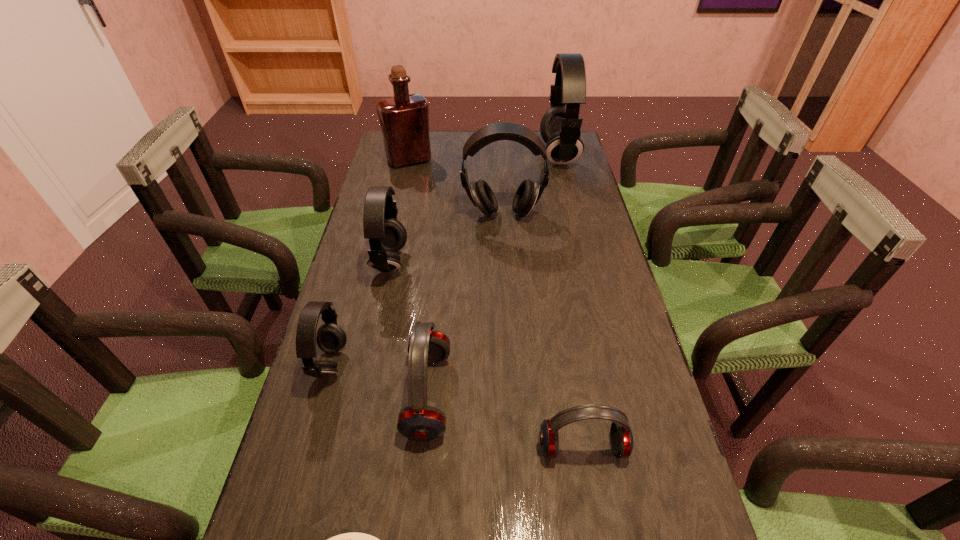
Image resolution: width=960 pixels, height=540 pixels. What are the coordinates of `vacant space that is in between the third farthest black earphone and the smallest black earphone` in the screenshot? It's located at (360, 314).

Find the location of `vacant region between the seventh tallest object and the sixth nearest object`. vacant region between the seventh tallest object and the sixth nearest object is located at coordinates (542, 330).

Image resolution: width=960 pixels, height=540 pixels. In order to click on vacant space that's between the second farthest black earphone and the leftmost black earphone in this screenshot , I will do `click(417, 289)`.

What are the coordinates of `free space between the third smallest black earphone and the left red earphone` in the screenshot? It's located at (466, 305).

Identify the location of free spot between the left red earphone and the third smallest black earphone. The width and height of the screenshot is (960, 540). coord(466,305).

Find the location of `free space between the tallest earphone and the bigger red earphone`. free space between the tallest earphone and the bigger red earphone is located at coordinates (493, 275).

Locate which object ranks second in proximity to the smallest black earphone. Please provide its 2D coordinates. Your answer should be formatted as a tuple, i.e. [(x, y)], where the tuple contains the x and y coordinates of a point satisfying the conditions above.

[(386, 235)]

Select which object is the seventh closest to the shortest earphone. Please provide its 2D coordinates. Your answer should be formatted as a tuple, i.e. [(x, y)], where the tuple contains the x and y coordinates of a point satisfying the conditions above.

[(404, 119)]

Identify the location of the fourth closest earphone to the brown liquor. (x=331, y=338).

Select which earphone appears as the fifth closest to the farthest black earphone. Please provide its 2D coordinates. Your answer should be formatted as a tuple, i.e. [(x, y)], where the tuple contains the x and y coordinates of a point satisfying the conditions above.

[(621, 436)]